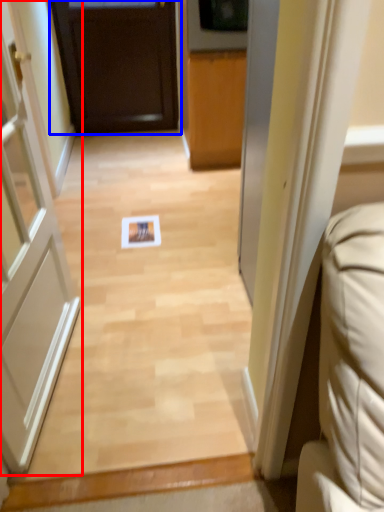
Question: Which object appears farthest to the camera in this image, door (highlighted by a red box) or door (highlighted by a blue box)?

Choices:
 (A) door
 (B) door

Answer: (B)